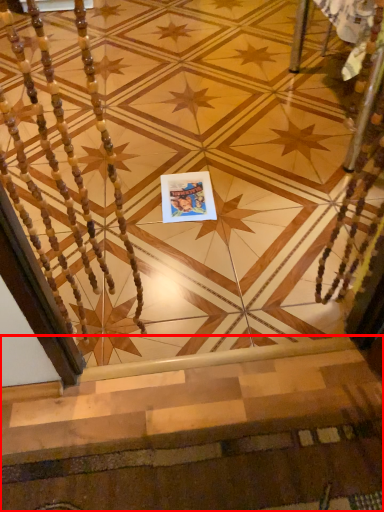
Question: From the image's perspective, where is stairs (annotated by the red box) located in relation to postcard in the image?

Choices:
 (A) below
 (B) above

Answer: (A)